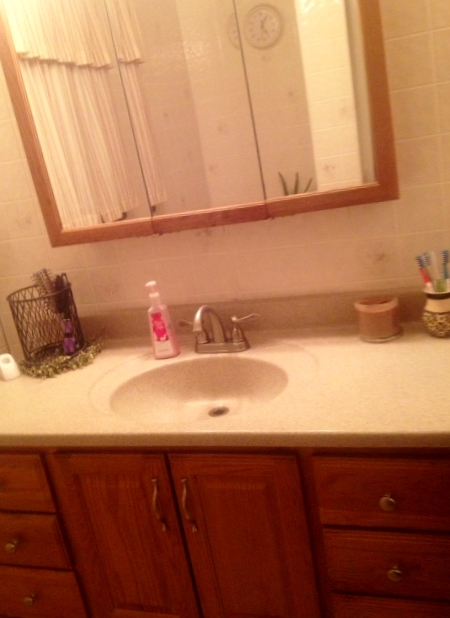
Where is `rectangular bathroom mirror`? The width and height of the screenshot is (450, 618). rectangular bathroom mirror is located at coordinates (72, 132).